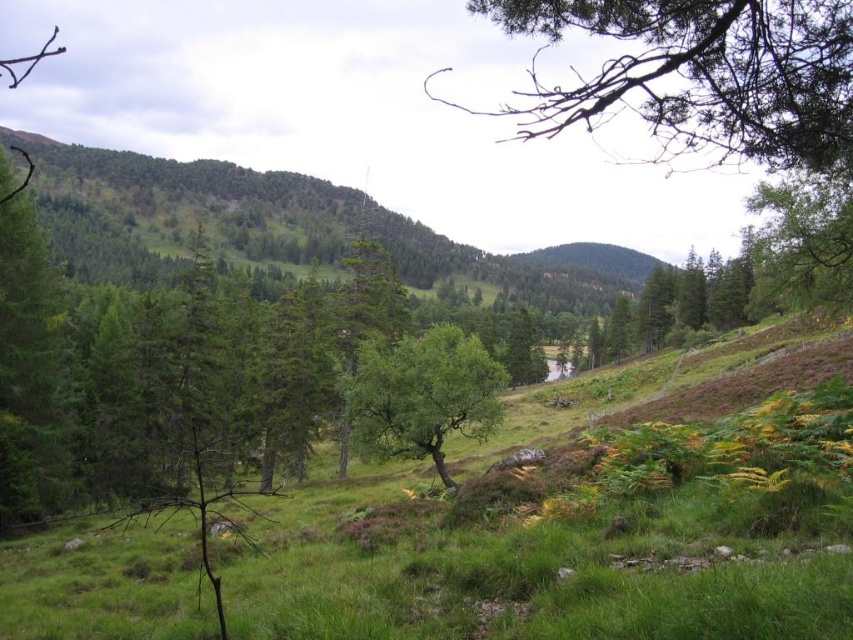
Question: Is green leafy tree at upper right behind green leafy tree at center?

Choices:
 (A) yes
 (B) no

Answer: (B)

Question: Which point appears closest to the camera in this image?

Choices:
 (A) (451, 355)
 (B) (773, 102)

Answer: (B)

Question: Which point is farther to the camera?

Choices:
 (A) green leafy tree at center
 (B) green leafy tree at upper right

Answer: (A)

Question: Can you confirm if green leafy tree at upper right is positioned above green leafy tree at center?

Choices:
 (A) no
 (B) yes

Answer: (B)

Question: Is green leafy tree at upper right smaller than green leafy tree at center?

Choices:
 (A) yes
 (B) no

Answer: (B)